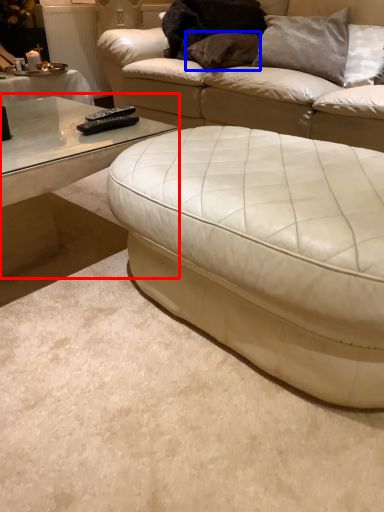
Question: Which point is further to the camera, coffee table (highlighted by a red box) or pillow (highlighted by a blue box)?

Choices:
 (A) coffee table
 (B) pillow

Answer: (B)